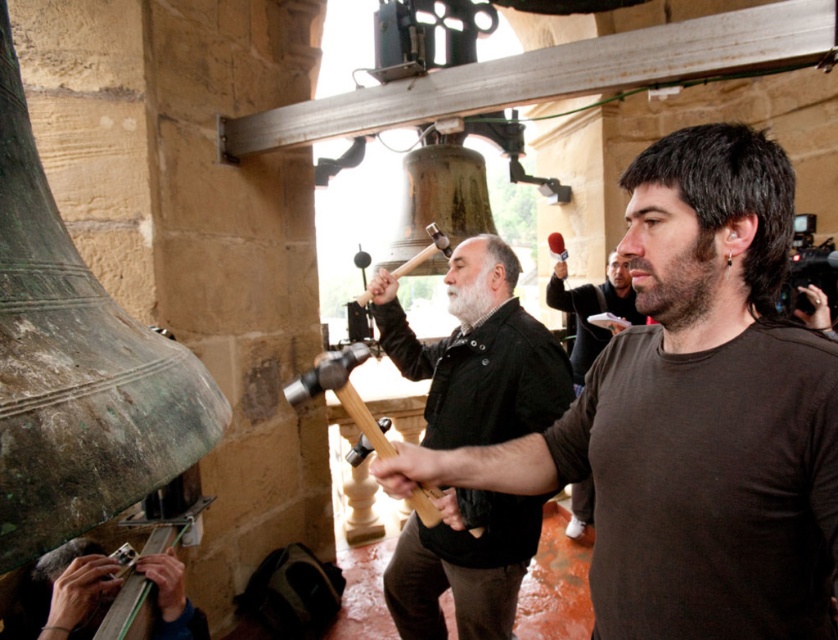
Question: Which object is farther from the camera taking this photo?

Choices:
 (A) brown matte shirt at center
 (B) dark brown leather jacket at center
 (C) white matte beard at center
 (D) brown cotton shirt at center

Answer: (A)

Question: Which object is positioned farthest from the brown matte shirt at center?

Choices:
 (A) dark brown leather jacket at center
 (B) metallic silver watch at lower left
 (C) white matte beard at center
 (D) brown cotton shirt at center

Answer: (B)

Question: Is the position of brown matte shirt at center less distant than that of white matte beard at center?

Choices:
 (A) no
 (B) yes

Answer: (A)

Question: Can you confirm if metallic silver watch at lower left is positioned above brown matte shirt at center?

Choices:
 (A) yes
 (B) no

Answer: (B)

Question: Among these objects, which one is nearest to the camera?

Choices:
 (A) white matte beard at center
 (B) dark brown beard at center
 (C) dark brown leather jacket at center

Answer: (B)

Question: Is metallic silver watch at lower left wider than white matte beard at center?

Choices:
 (A) yes
 (B) no

Answer: (A)